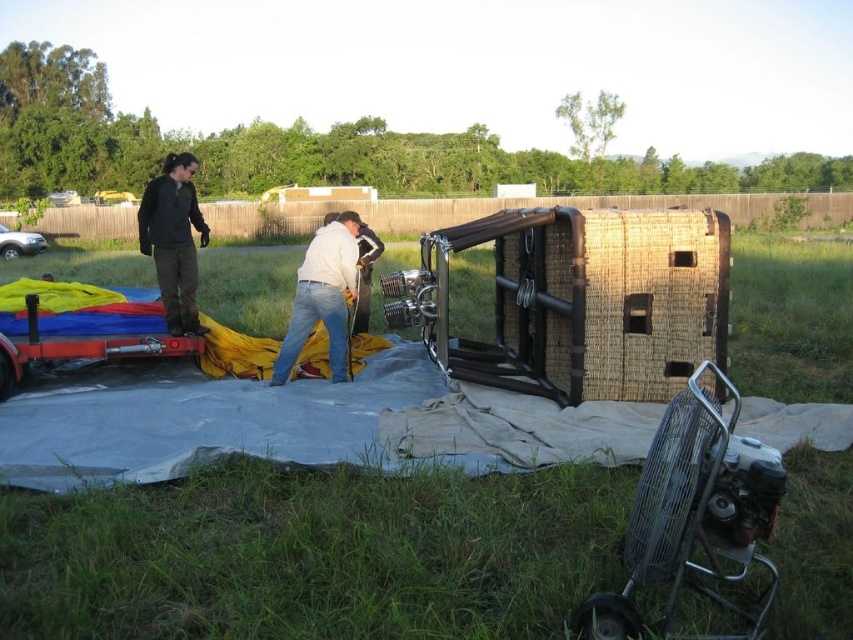
You are planning to set up a temporary stage between the metallic silver fan at lower right and the silver metallic car at left for a small event. Given the distance between them, can the stage, which requires a minimum of 30 meters of space, be accommodated?

The metallic silver fan at lower right and silver metallic car at left are 29.55 meters apart. Since the required space is 30 meters, the stage cannot be accommodated as the available distance is slightly less than needed.

You are a photographer wanting to capture both the metallic silver fan at lower right and the silver metallic car at left in the same frame. Given their sizes, which object should you focus on to ensure both fit in the photo without cropping?

Since the metallic silver fan at lower right is wider than the silver metallic car at left, you should focus on the metallic silver fan at lower right to ensure both fit in the photo without cropping.